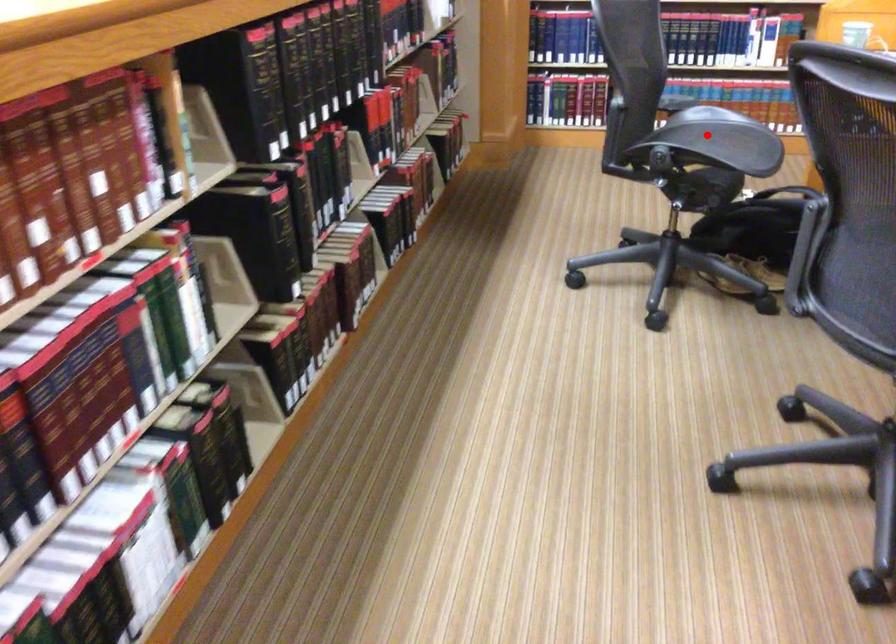
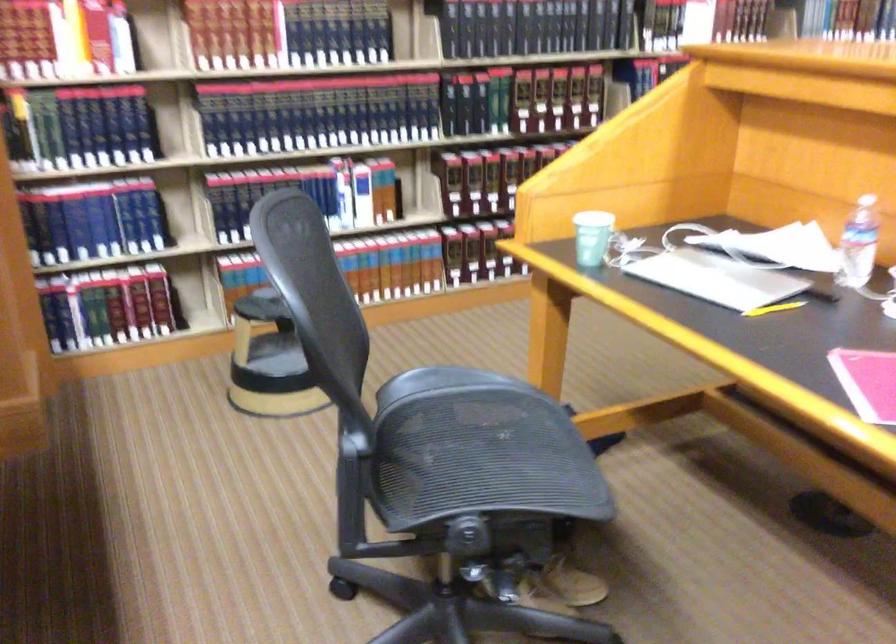
Question: I am providing you with two images of the same scene from different viewpoints. In image1, a red point is highlighted. Considering the same 3D point in image2, which of the following is correct?

Choices:
 (A) It is closer
 (B) It is farther

Answer: (A)